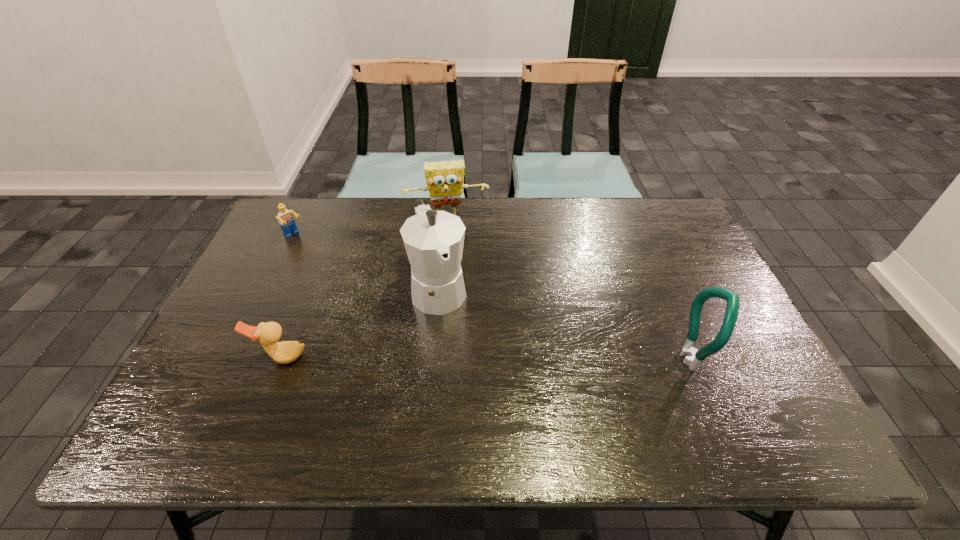
Choose which object is the nearest neighbor to the duck. Please provide its 2D coordinates. Your answer should be formatted as a tuple, i.e. [(x, y)], where the tuple contains the x and y coordinates of a point satisfying the conditions above.

[(434, 240)]

Select which object is the fourth closest to the fourth object from right to left. Please provide its 2D coordinates. Your answer should be formatted as a tuple, i.e. [(x, y)], where the tuple contains the x and y coordinates of a point satisfying the conditions above.

[(693, 358)]

What are the coordinates of `free space that satisfies the following two spatial constraints: 1. on the beak of the bottle opener; 2. at the jaws of the fourth object from right to left` in the screenshot? It's located at (281, 359).

At what (x,y) coordinates should I click in order to perform the action: click on vacant area in the image that satisfies the following two spatial constraints: 1. on the beak of the bottle opener; 2. at the jaws of the duck. Please return your answer as a coordinate pair (x, y). This screenshot has height=540, width=960. Looking at the image, I should click on (281, 359).

At what (x,y) coordinates should I click in order to perform the action: click on free spot that satisfies the following two spatial constraints: 1. on the back side of the leftmost object; 2. on the right side of the sponge. Please return your answer as a coordinate pair (x, y). The image size is (960, 540). Looking at the image, I should click on (302, 220).